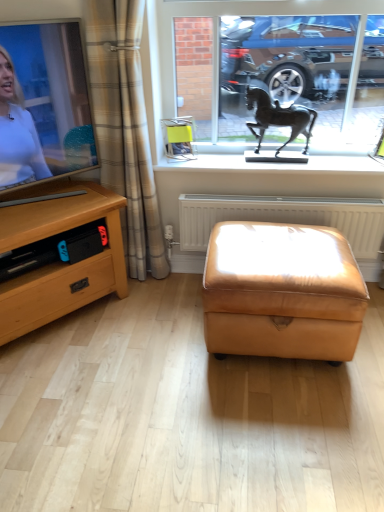
The width and height of the screenshot is (384, 512). I want to click on vacant space underneath wooden desk at left (from a real-world perspective), so click(x=70, y=319).